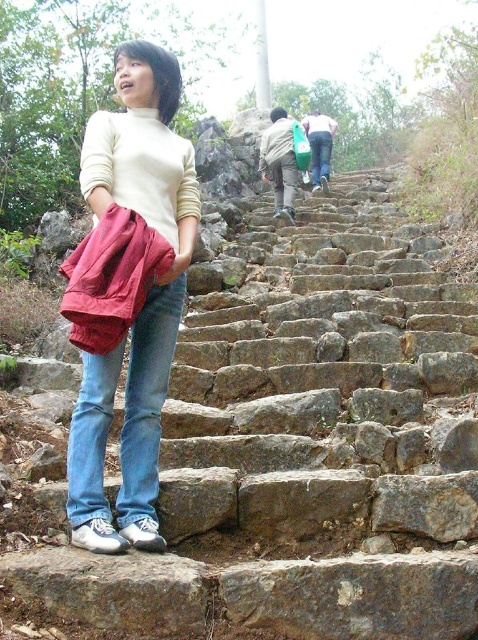
You are a hiker who wants to place your green fabric bag at upper center on the rustic stone stairs at center. Can you fit it there based on their sizes?

The rustic stone stairs at center is bigger than green fabric bag at upper center, so yes, the green fabric bag at upper center can fit on the rustic stone stairs at center since the stairs are larger in size.

You are a photographer trying to capture the scene. You notice the blue denim jeans at lower left and the green fabric bag at upper center. Which object appears smaller in the photo?

The blue denim jeans at lower left appears smaller in the photo compared to the green fabric bag at upper center.

You are a hiker trying to pass a narrow section of the rustic stone stairs at center. You see a green fabric bag at upper center placed on one of the steps. Can you step over it without moving the bag?

The rustic stone stairs at center might be wider than green fabric bag at upper center, so there might be enough space to step over it without moving the bag.